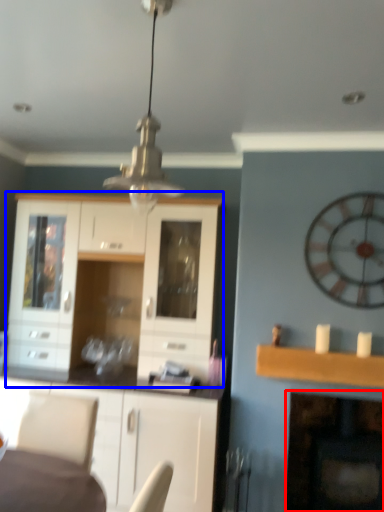
Question: Which object is closer to the camera taking this photo, fireplace (highlighted by a red box) or cabinetry (highlighted by a blue box)?

Choices:
 (A) fireplace
 (B) cabinetry

Answer: (B)